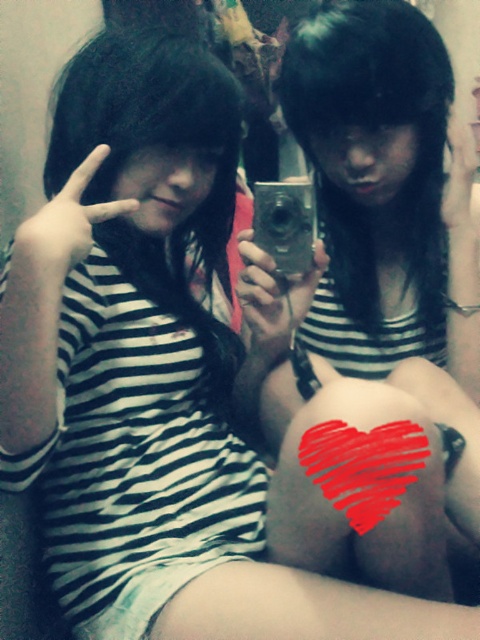
Does point (371, 284) come closer to viewer compared to point (336, 444)?

No.

Is matte black camera at center bigger than red painted heart at center?

Correct, matte black camera at center is larger in size than red painted heart at center.

Does point (411, 12) come farther from viewer compared to point (418, 451)?

Yes.

The image size is (480, 640). Find the location of `matte black camera at center`. matte black camera at center is located at coordinates (384, 195).